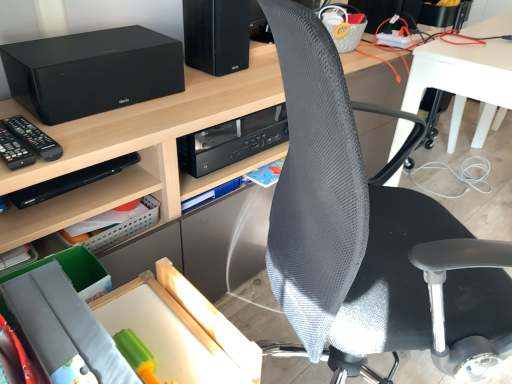
Question: From the image's perspective, is black plastic remote control at left located above or below black mesh chair at center?

Choices:
 (A) above
 (B) below

Answer: (A)

Question: Is black plastic remote control at left inside the boundaries of black mesh chair at center, or outside?

Choices:
 (A) inside
 (B) outside

Answer: (B)

Question: Estimate the real-world distances between objects in this image. Which object is closer to the black matte speaker at upper left?

Choices:
 (A) black mesh chair at center
 (B) black matte computer tower at upper center
 (C) black plastic remote control at left
 (D) black plastic shelf at lower left

Answer: (C)

Question: Considering the real-world distances, which object is farthest from the black plastic shelf at lower left?

Choices:
 (A) black matte computer tower at upper center
 (B) black matte speaker at upper left
 (C) black mesh chair at center
 (D) black plastic remote control at left

Answer: (C)